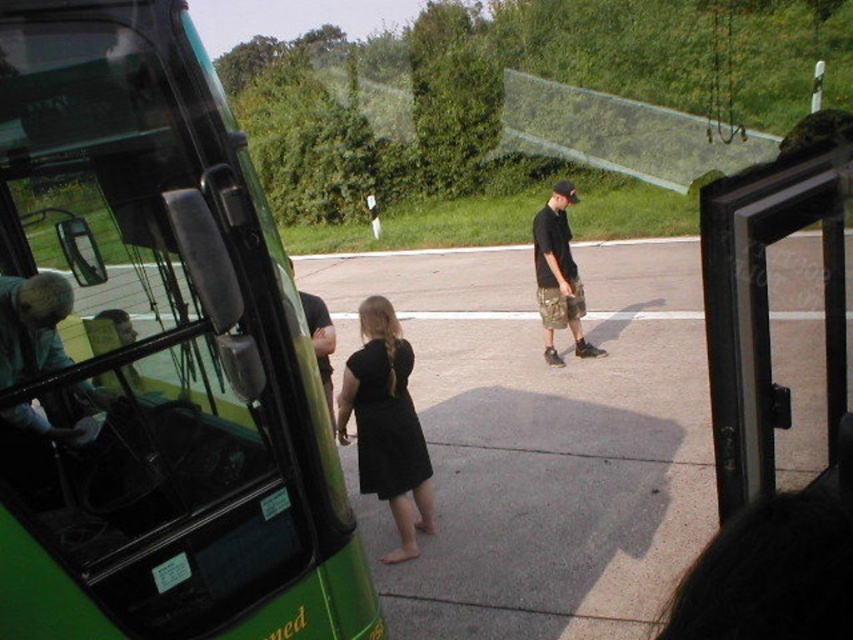
You are inside a bus and looking through the window. You notice a point marked at coordinates (x=386, y=422). What object is located at that point?

The point at (x=386, y=422) indicates a black matte dress at center.

You are a passenger on the bus and looking out the window. You notice two people standing outside the bus. Which of the two people is wearing an outfit that is thinner in width between the black matte dress at center and the camo shorts at center?

The black matte dress at center is thinner than the camo shorts at center, so the person wearing the black matte dress at center has the thinner outfit in width.

You are a passenger on the bus and want to get off at the next stop. You notice the green matte bus at left and the camo shorts at center. Which object is closer to you as a passenger?

The green matte bus at left is closer to you as a passenger because it is in front of the camo shorts at center.